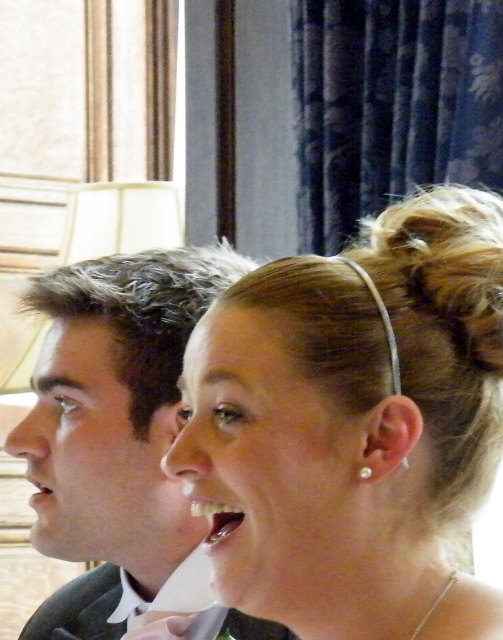
Which is more to the right, matte black suit at left or white glossy teeth at center?

white glossy teeth at center

Can you confirm if matte black suit at left is wider than white glossy teeth at center?

Indeed, matte black suit at left has a greater width compared to white glossy teeth at center.

Which is in front, point (134, 531) or point (232, 504)?

Point (232, 504)

What are the coordinates of `matte black suit at left` in the screenshot? It's located at (114, 428).

Is matte black suit at left below matte white teeth at lower left?

Actually, matte black suit at left is above matte white teeth at lower left.

Between point (240, 620) and point (34, 499), which one is positioned in front?

Point (240, 620)

Which is behind, point (49, 509) or point (51, 493)?

The point (51, 493) is behind.

You are a GUI agent. You are given a task and a screenshot of the screen. Output one action in this format:
    pyautogui.click(x=<x>, y=<y>)
    Task: Click on the matte black suit at left
    This screenshot has height=640, width=503.
    Given the screenshot: What is the action you would take?
    pyautogui.click(x=114, y=428)

Who is positioned more to the left, matte silver headband at upper center or white glossy teeth at center?

From the viewer's perspective, white glossy teeth at center appears more on the left side.

Is matte silver headband at upper center taller than white glossy teeth at center?

Indeed, matte silver headband at upper center has a greater height compared to white glossy teeth at center.

Is point (271, 349) closer to camera compared to point (217, 509)?

Yes, it is in front of point (217, 509).

Locate an element on the screen. matte silver headband at upper center is located at coordinates (355, 424).